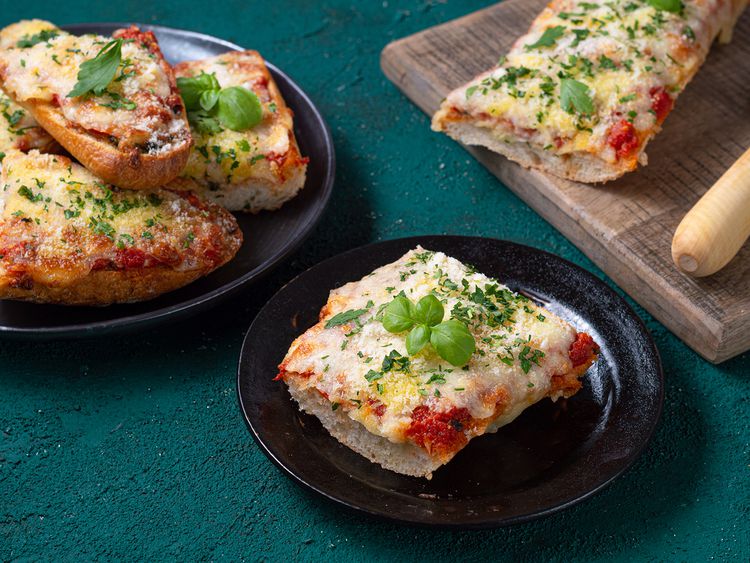
Locate an element on the screen. This screenshot has height=563, width=750. wooden handle is located at coordinates (680, 257), (706, 201), (746, 158), (745, 207), (733, 254), (700, 272), (712, 231).